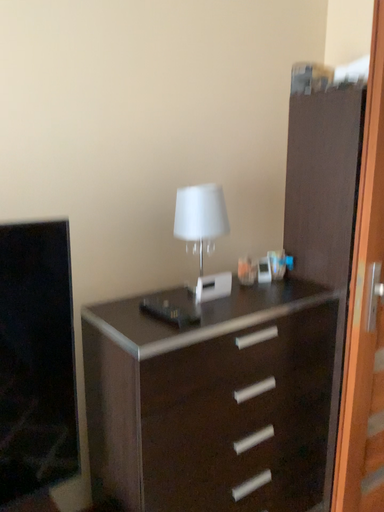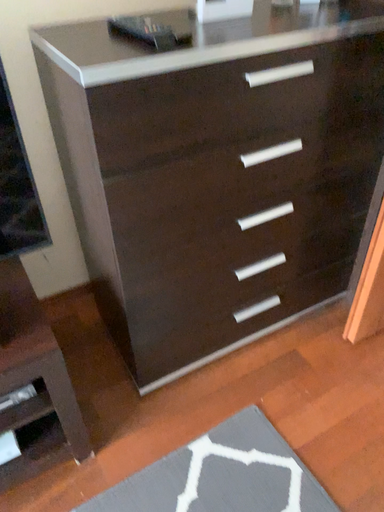
Question: Which way did the camera rotate in the video?

Choices:
 (A) rotated upward
 (B) rotated downward

Answer: (B)